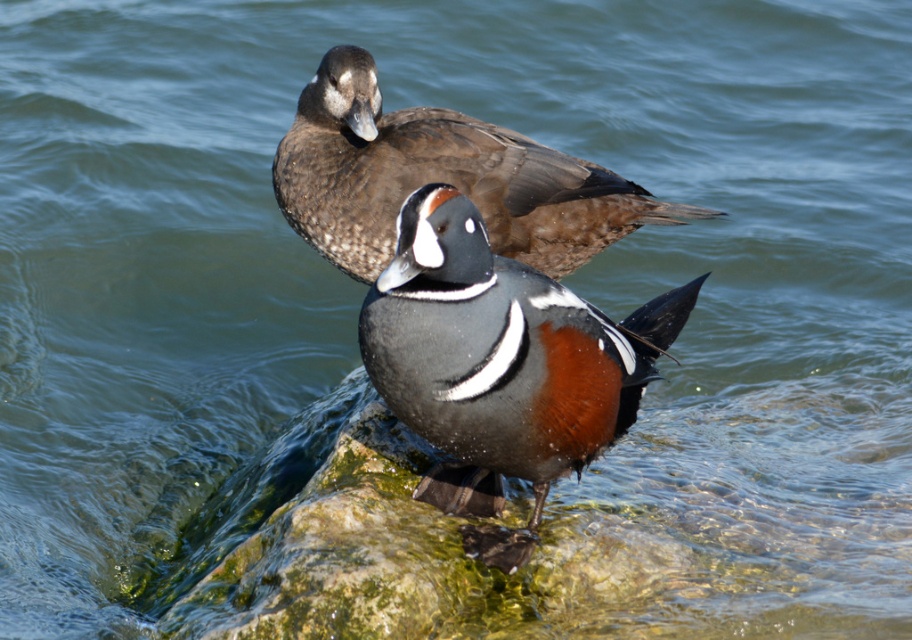
From the picture: You are a photographer standing 2 meters away from the matte black duck at center. You want to take a closeup photo of it. Is your current distance sufficient to capture the duck clearly without moving closer?

The distance between the matte black duck at center and the camera is 1.98 meters, which is just under 2 meters. This should be sufficient for a clear closeup photo without needing to move closer.

You are a birdwatcher observing two ducks on a rock. You see the matte black duck at center and the brown speckled duck at upper center. Which duck is positioned more to the right side of the rock?

The matte black duck at center is positioned more to the right side of the rock than the brown speckled duck at upper center.